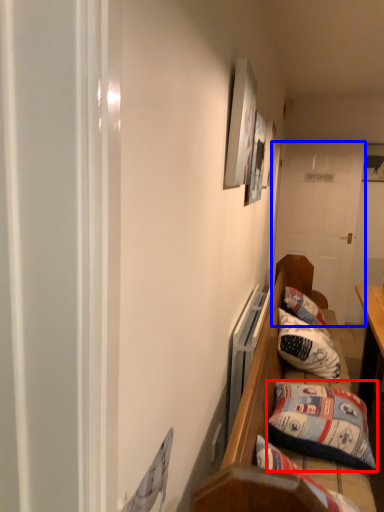
Question: Among these objects, which one is farthest to the camera, pillow (highlighted by a red box) or door (highlighted by a blue box)?

Choices:
 (A) pillow
 (B) door

Answer: (B)